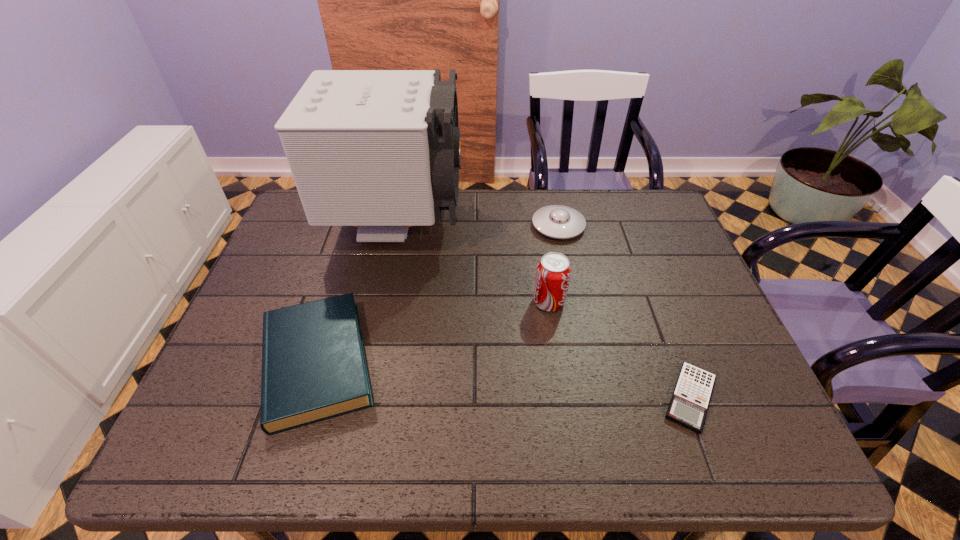
Find the location of a particular element. This screenshot has width=960, height=540. object that is positioned at the near right corner is located at coordinates (688, 407).

The height and width of the screenshot is (540, 960). I want to click on blank space at the far edge of the desktop, so click(x=450, y=228).

I want to click on vacant point at the near edge, so click(512, 431).

At what (x,y) coordinates should I click in order to perform the action: click on vacant space at the left edge. Please return your answer as a coordinate pair (x, y). The width and height of the screenshot is (960, 540). Looking at the image, I should click on (270, 275).

What are the coordinates of `vacant space at the right edge of the desktop` in the screenshot? It's located at (x=720, y=395).

Locate an element on the screen. vacant space at the far left corner of the desktop is located at coordinates (304, 214).

Image resolution: width=960 pixels, height=540 pixels. Find the location of `free region at the far right corner`. free region at the far right corner is located at coordinates (653, 213).

Where is `vacant area between the shortest object and the fan`? vacant area between the shortest object and the fan is located at coordinates (543, 311).

You are a GUI agent. You are given a task and a screenshot of the screen. Output one action in this format:
    pyautogui.click(x=<x>, y=<y>)
    Task: Click on the free space between the book and the calculator
    This screenshot has height=540, width=960.
    Given the screenshot: What is the action you would take?
    pyautogui.click(x=504, y=380)

At what (x,y) coordinates should I click in order to perform the action: click on vacant region between the tallest object and the soda. Please return your answer as a coordinate pair (x, y). The width and height of the screenshot is (960, 540). Looking at the image, I should click on (473, 264).